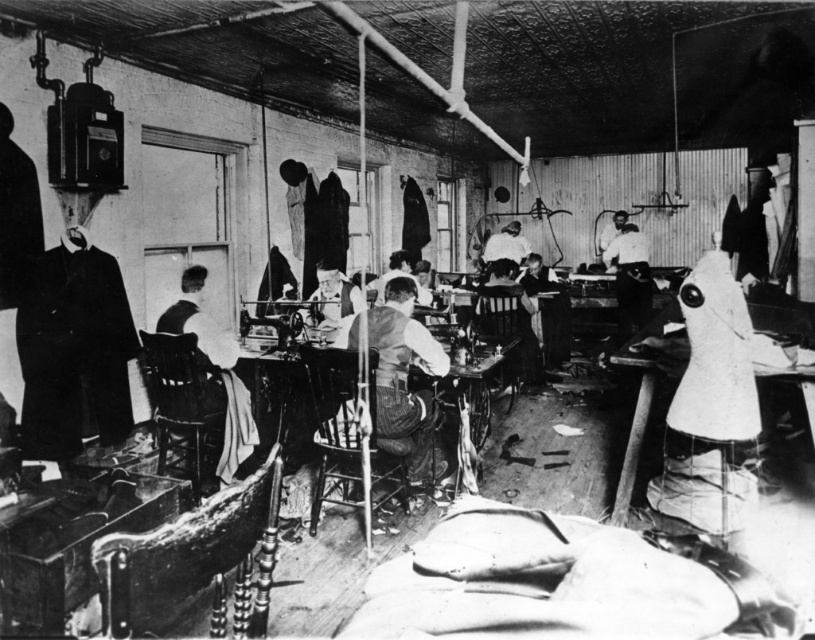
Does white fabric shirt at upper center appear over light brown leather jacket at center?

Yes.

Which is more to the right, white fabric shirt at upper center or light brown leather jacket at center?

From the viewer's perspective, white fabric shirt at upper center appears more on the right side.

Is point (514, 248) positioned before point (417, 289)?

No.

What are the coordinates of `white fabric shirt at upper center` in the screenshot? It's located at (505, 244).

Is matte black vest at center in front of white fabric shirt at upper center?

Yes, matte black vest at center is in front of white fabric shirt at upper center.

Measure the distance between matte black vest at center and white fabric shirt at upper center.

matte black vest at center is 18.76 feet away from white fabric shirt at upper center.

Between point (425, 401) and point (492, 236), which one is positioned behind?

Positioned behind is point (492, 236).

The image size is (815, 640). Find the location of `matte black vest at center`. matte black vest at center is located at coordinates (402, 374).

Is point (425, 330) more distant than point (390, 266)?

No, (425, 330) is in front of (390, 266).

Can you confirm if matte black vest at center is thinner than light brown leather jacket at center?

Yes.

Which is behind, point (421, 454) or point (388, 280)?

Positioned behind is point (388, 280).

You are a GUI agent. You are given a task and a screenshot of the screen. Output one action in this format:
    pyautogui.click(x=<x>, y=<y>)
    Task: Click on the matte black vest at center
    This screenshot has height=640, width=815.
    Given the screenshot: What is the action you would take?
    pyautogui.click(x=402, y=374)